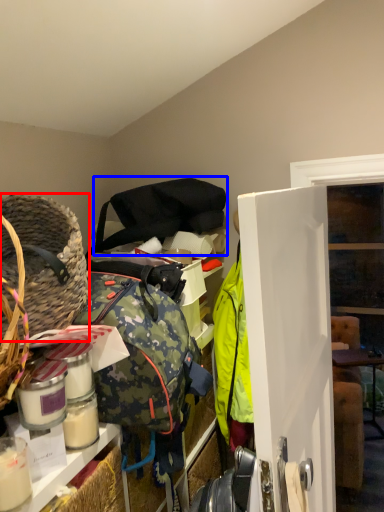
Question: Which point is closer to the camera, basket (highlighted by a red box) or shoulder bag (highlighted by a blue box)?

Choices:
 (A) basket
 (B) shoulder bag

Answer: (A)